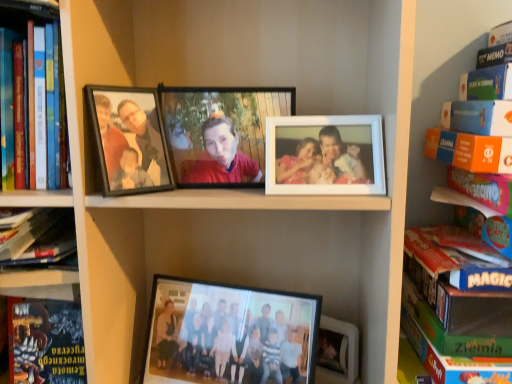
At what (x,y) coordinates should I click in order to perform the action: click on hardcover book at left, acting as the second book starting from the right. Please return your answer as a coordinate pair (x, y). This screenshot has height=384, width=512. Looking at the image, I should click on click(42, 95).

This screenshot has height=384, width=512. Identify the location of black matte photo frame at upper left, marked as the 1th picture frame in a left-to-right arrangement. (129, 140).

In order to face black matte photo frame at upper left, positioned as the second picture frame in right-to-left order, should I rotate leftwards or rightwards?

Rotate left and turn 16.186 degrees.

Measure the distance between hardcover book at left, the 2th book from the left, and camera.

The distance of hardcover book at left, the 2th book from the left, from camera is 25.25 inches.

Where is `hardcover book at left, the 4th book when ordered from right to left`? hardcover book at left, the 4th book when ordered from right to left is located at coordinates (40, 240).

Locate an element on the screen. hardcover book at lower left is located at coordinates (45, 342).

The height and width of the screenshot is (384, 512). Find the location of `matte black photo frame at center, arranged as the second picture frame when viewed from the left`. matte black photo frame at center, arranged as the second picture frame when viewed from the left is located at coordinates (220, 132).

The width and height of the screenshot is (512, 384). In order to click on green cardboard book at right, which ranks as the 1th book in right-to-left order in this screenshot , I will do `click(441, 88)`.

Locate an element on the screen. The height and width of the screenshot is (384, 512). hardcover book at left, acting as the second book starting from the right is located at coordinates (42, 95).

Does point (450, 54) come behind point (23, 270)?

Yes, point (450, 54) is behind point (23, 270).

From the image's perspective, is green cardboard book at right, which ranks as the 1th book in right-to-left order, beneath hardcover book at left, the 2th book from the left?

No.

Are green cardboard book at right, which ranks as the 1th book in right-to-left order, and hardcover book at left, the 2th book from the left, located far from each other?

They are positioned close to each other.

Can hardcover book at left, the 2th book from the left, be found inside green cardboard book at right, which ranks as the 1th book in right-to-left order?

Actually, hardcover book at left, the 2th book from the left, is outside green cardboard book at right, which ranks as the 1th book in right-to-left order.

Which of these two, green cardboard book at right, which is the fourth book from left to right, or black matte photo frame at upper left, marked as the 1th picture frame in a left-to-right arrangement, is thinner?

black matte photo frame at upper left, marked as the 1th picture frame in a left-to-right arrangement.

Would you consider green cardboard book at right, which is the fourth book from left to right, to be distant from black matte photo frame at upper left, positioned as the second picture frame in right-to-left order?

No, green cardboard book at right, which is the fourth book from left to right, is not far from black matte photo frame at upper left, positioned as the second picture frame in right-to-left order.

Which is nearer, (447, 2) or (105, 146)?

The point (105, 146) is more forward.

From a real-world perspective, is green cardboard book at right, which is the fourth book from left to right, physically located above or below black matte photo frame at upper left, marked as the 1th picture frame in a left-to-right arrangement?

green cardboard book at right, which is the fourth book from left to right, is below black matte photo frame at upper left, marked as the 1th picture frame in a left-to-right arrangement.

From the image's perspective, does hardcover book at left, the 4th book when ordered from right to left, appear lower than green cardboard book at right, which is the fourth book from left to right?

No, from the image's perspective, hardcover book at left, the 4th book when ordered from right to left, is not below green cardboard book at right, which is the fourth book from left to right.

Is hardcover book at left, marked as the 1th book in a left-to-right arrangement, inside or outside of green cardboard book at right, which is the fourth book from left to right?

hardcover book at left, marked as the 1th book in a left-to-right arrangement, is located beyond the bounds of green cardboard book at right, which is the fourth book from left to right.

Locate an element on the screen. the 3rd book to the right of the hardcover book at left, marked as the 1th book in a left-to-right arrangement, counting from the anchor's position is located at coordinates (441, 88).

Is hardcover book at lower left positioned beyond the bounds of hardcover book at left, marked as the 1th book in a left-to-right arrangement?

Yes, hardcover book at lower left is outside of hardcover book at left, marked as the 1th book in a left-to-right arrangement.

Is hardcover book at lower left aimed at hardcover book at left, marked as the 1th book in a left-to-right arrangement?

No, hardcover book at lower left is not turned towards hardcover book at left, marked as the 1th book in a left-to-right arrangement.

From the picture: From a real-world perspective, is hardcover book at lower left on top of hardcover book at left, the 4th book when ordered from right to left?

Incorrect, from a real-world perspective, hardcover book at lower left is lower than hardcover book at left, the 4th book when ordered from right to left.

Considering the positions of objects hardcover book at lower left and hardcover book at left, marked as the 1th book in a left-to-right arrangement, in the image provided, who is in front, hardcover book at lower left or hardcover book at left, marked as the 1th book in a left-to-right arrangement,?

hardcover book at left, marked as the 1th book in a left-to-right arrangement, is closer to the camera.

Consider the image. From the image's perspective, which is above, hardcover book at lower left or green cardboard book at right, which ranks as the 1th book in right-to-left order?

green cardboard book at right, which ranks as the 1th book in right-to-left order, appears higher in the image.

Consider the image. Can you tell me how much hardcover book at lower left and green cardboard book at right, which ranks as the 1th book in right-to-left order, differ in facing direction?

There is a 13.3-degree angle between the facing directions of hardcover book at lower left and green cardboard book at right, which ranks as the 1th book in right-to-left order.

From a real-world perspective, relative to green cardboard book at right, which ranks as the 1th book in right-to-left order, is hardcover book at lower left vertically above or below?

From a real-world perspective, hardcover book at lower left is physically below green cardboard book at right, which ranks as the 1th book in right-to-left order.

Can you confirm if hardcover book at lower left is shorter than green cardboard book at right, which ranks as the 1th book in right-to-left order?

Yes, hardcover book at lower left is shorter than green cardboard book at right, which ranks as the 1th book in right-to-left order.

Is hardcover book at lower left turned away from hardcover book at left, acting as the second book starting from the right?

hardcover book at lower left does not have its back to hardcover book at left, acting as the second book starting from the right.

Considering the sizes of objects hardcover book at lower left and hardcover book at left, arranged as the third book when viewed from the left, in the image provided, who is smaller, hardcover book at lower left or hardcover book at left, arranged as the third book when viewed from the left,?

hardcover book at lower left is smaller.

In terms of width, does hardcover book at lower left look wider or thinner when compared to hardcover book at left, acting as the second book starting from the right?

In the image, hardcover book at lower left appears to be more narrow than hardcover book at left, acting as the second book starting from the right.

From a real-world perspective, does hardcover book at lower left stand above hardcover book at left, acting as the second book starting from the right?

No, from a real-world perspective, hardcover book at lower left is not above hardcover book at left, acting as the second book starting from the right.

Is black matte photo frame at upper left, positioned as the second picture frame in right-to-left order, at the right side of hardcover book at lower left?

Yes, black matte photo frame at upper left, positioned as the second picture frame in right-to-left order, is to the right of hardcover book at lower left.

Considering the sizes of black matte photo frame at upper left, positioned as the second picture frame in right-to-left order, and hardcover book at lower left in the image, is black matte photo frame at upper left, positioned as the second picture frame in right-to-left order, taller or shorter than hardcover book at lower left?

Clearly, black matte photo frame at upper left, positioned as the second picture frame in right-to-left order, is shorter compared to hardcover book at lower left.

Is black matte photo frame at upper left, marked as the 1th picture frame in a left-to-right arrangement, oriented towards hardcover book at lower left?

No, black matte photo frame at upper left, marked as the 1th picture frame in a left-to-right arrangement, does not turn towards hardcover book at lower left.

Image resolution: width=512 pixels, height=384 pixels. What are the coordinates of `book that is the 1st one when counting backward from the green cardboard book at right, which is the fourth book from left to right` in the screenshot? It's located at (44, 326).

There is a black matte photo frame at upper left, positioned as the second picture frame in right-to-left order. What are the coordinates of `the 2nd book below it (from a real-world perspective)` in the screenshot? It's located at (441, 88).

From the picture: From the image, which object appears to be farther from green cardboard book at right, which ranks as the 1th book in right-to-left order, black matte photo frame at upper left, positioned as the second picture frame in right-to-left order, or hardcover book at left, marked as the 1th book in a left-to-right arrangement?

hardcover book at left, marked as the 1th book in a left-to-right arrangement, is positioned further to the anchor green cardboard book at right, which ranks as the 1th book in right-to-left order.

Considering their positions, is hardcover book at left, arranged as the third book when viewed from the left, positioned closer to hardcover book at left, marked as the 1th book in a left-to-right arrangement, than hardcover book at left, the 2th book from the left?

The object closer to hardcover book at left, marked as the 1th book in a left-to-right arrangement, is hardcover book at left, the 2th book from the left.

From the image, which object appears to be nearer to matte black photo frame at center, arranged as the second picture frame when viewed from the left, green cardboard book at right, which ranks as the 1th book in right-to-left order, or hardcover book at left, the 4th book when ordered from right to left?

Among the two, hardcover book at left, the 4th book when ordered from right to left, is located nearer to matte black photo frame at center, arranged as the second picture frame when viewed from the left.

In the scene shown: From the image, which object appears to be farther from black matte photo frame at upper left, positioned as the second picture frame in right-to-left order, hardcover book at left, arranged as the third book when viewed from the right, or green cardboard book at right, which ranks as the 1th book in right-to-left order?

green cardboard book at right, which ranks as the 1th book in right-to-left order, is further to black matte photo frame at upper left, positioned as the second picture frame in right-to-left order.

From the picture: When comparing their distances from green cardboard book at right, which is the fourth book from left to right, does hardcover book at left, arranged as the third book when viewed from the right, or hardcover book at lower left seem closer?

Among the two, hardcover book at left, arranged as the third book when viewed from the right, is located nearer to green cardboard book at right, which is the fourth book from left to right.

From the image, which object appears to be nearer to green cardboard book at right, which is the fourth book from left to right, hardcover book at left, arranged as the third book when viewed from the right, or hardcover book at left, acting as the second book starting from the right?

Based on the image, hardcover book at left, acting as the second book starting from the right, appears to be nearer to green cardboard book at right, which is the fourth book from left to right.

When comparing their distances from hardcover book at left, acting as the second book starting from the right, does hardcover book at left, the 2th book from the left, or matte black photo frame at center, the first picture frame from the right, seem closer?

The object closer to hardcover book at left, acting as the second book starting from the right, is hardcover book at left, the 2th book from the left.

Considering their positions, is matte black photo frame at center, the first picture frame from the right, positioned closer to hardcover book at lower left than black matte photo frame at upper left, positioned as the second picture frame in right-to-left order?

black matte photo frame at upper left, positioned as the second picture frame in right-to-left order, is closer to hardcover book at lower left.

Locate an element on the screen. picture frame located between hardcover book at left, arranged as the third book when viewed from the left, and matte black photo frame at center, arranged as the second picture frame when viewed from the left, in the left-right direction is located at coordinates (129, 140).

The width and height of the screenshot is (512, 384). In order to click on picture frame between hardcover book at left, marked as the 1th book in a left-to-right arrangement, and matte black photo frame at center, arranged as the second picture frame when viewed from the left in this screenshot , I will do `click(129, 140)`.

The image size is (512, 384). What are the coordinates of `paperback book located between hardcover book at left, the 4th book when ordered from right to left, and matte black photo frame at center, the first picture frame from the right, in the left-right direction` in the screenshot? It's located at (45, 342).

Image resolution: width=512 pixels, height=384 pixels. I want to click on paperback book between hardcover book at left, acting as the second book starting from the right, and green cardboard book at right, which ranks as the 1th book in right-to-left order, so click(45, 342).